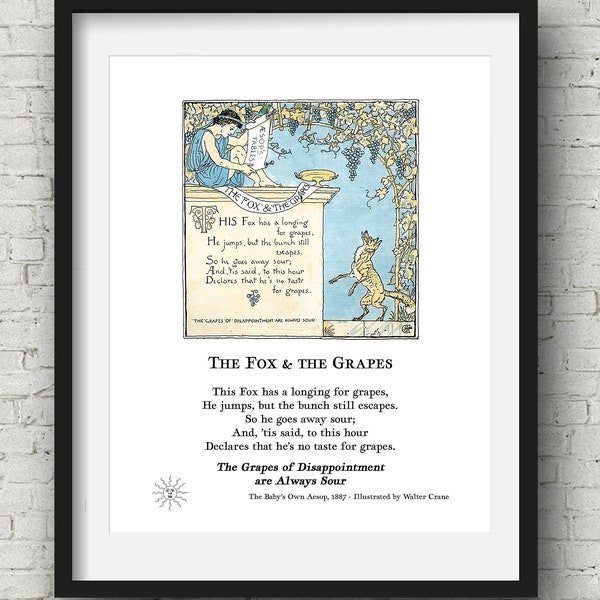
Locate an element on the screen. The height and width of the screenshot is (600, 600). frame is located at coordinates (525, 320).